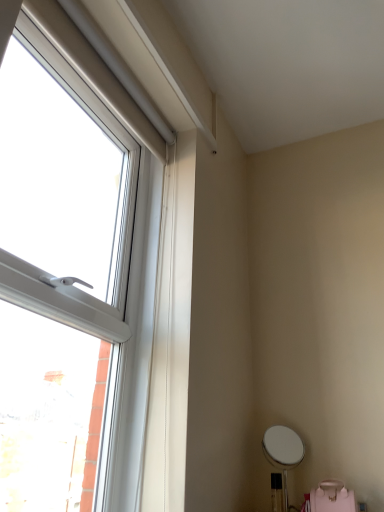
Question: In terms of width, does pink matte swivel chair at lower right look wider or thinner when compared to transparent plastic window at left?

Choices:
 (A) wide
 (B) thin

Answer: (A)

Question: Does point (350, 505) appear closer or farther from the camera than point (117, 121)?

Choices:
 (A) closer
 (B) farther

Answer: (A)

Question: From a real-world perspective, is pink matte swivel chair at lower right above or below transparent plastic window at left?

Choices:
 (A) above
 (B) below

Answer: (B)

Question: Considering the relative positions of transparent plastic window at left and pink matte swivel chair at lower right in the image provided, is transparent plastic window at left to the left or to the right of pink matte swivel chair at lower right?

Choices:
 (A) right
 (B) left

Answer: (B)

Question: Would you say transparent plastic window at left is inside or outside pink matte swivel chair at lower right?

Choices:
 (A) outside
 (B) inside

Answer: (A)

Question: Based on their sizes in the image, would you say transparent plastic window at left is bigger or smaller than pink matte swivel chair at lower right?

Choices:
 (A) small
 (B) big

Answer: (B)

Question: Is transparent plastic window at left taller or shorter than pink matte swivel chair at lower right?

Choices:
 (A) short
 (B) tall

Answer: (B)